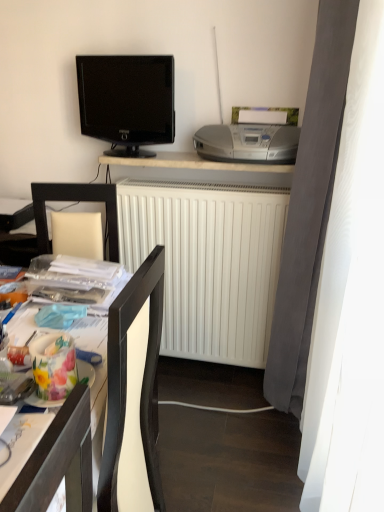
Question: Looking at the image, does white matte desk at upper center, the 1th desk positioned from the back, seem bigger or smaller compared to wooden desk at lower left, the 1th desk viewed from the front?

Choices:
 (A) big
 (B) small

Answer: (B)

Question: From their relative heights in the image, would you say white matte desk at upper center, which ranks as the 2th desk in front-to-back order, is taller or shorter than wooden desk at lower left, which ranks as the second desk in back-to-front order?

Choices:
 (A) short
 (B) tall

Answer: (A)

Question: Considering the real-world distances, which object is farthest from the wooden desk at lower left, which is the 1th desk in bottom-to-top order?

Choices:
 (A) silver metallic stereo at upper right
 (B) white matte radiator at center
 (C) white matte desk at upper center, the first desk when ordered from top to bottom
 (D) black glossy tv at upper left

Answer: (D)

Question: Estimate the real-world distances between objects in this image. Which object is farther from the black glossy tv at upper left?

Choices:
 (A) white matte desk at upper center, which ranks as the 2th desk in front-to-back order
 (B) silver metallic stereo at upper right
 (C) white matte radiator at center
 (D) wooden desk at lower left, arranged as the 2th desk when viewed from the top

Answer: (D)